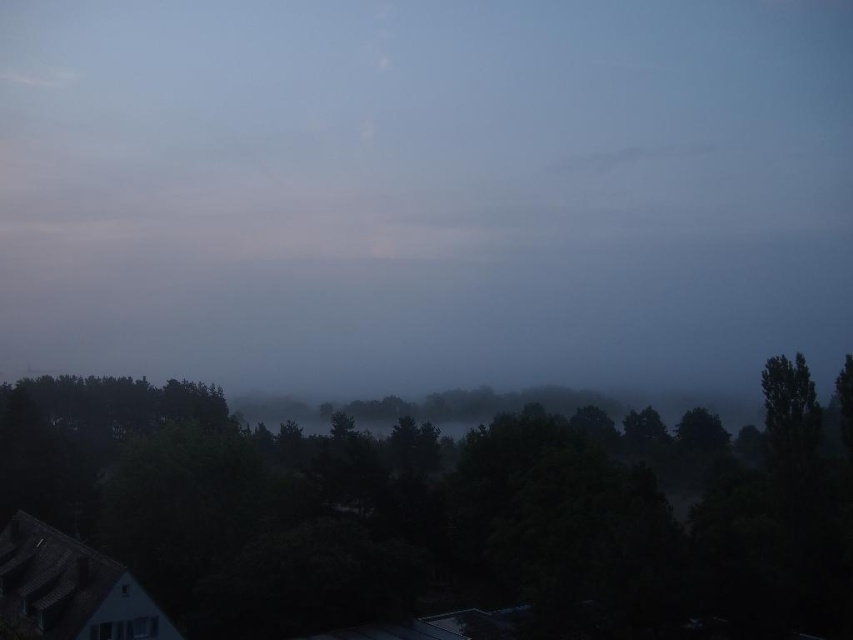
Does transparent mist at center appear on the left side of green matte tree at right?

Correct, you'll find transparent mist at center to the left of green matte tree at right.

What do you see at coordinates (425, 189) in the screenshot? This screenshot has height=640, width=853. I see `transparent mist at center` at bounding box center [425, 189].

Between point (816, 285) and point (799, 454), which one is positioned in front?

Point (799, 454)

The height and width of the screenshot is (640, 853). Identify the location of transparent mist at center. (425, 189).

Can you confirm if dark green leafy tree at center is positioned below green matte tree at right?

Correct, dark green leafy tree at center is located below green matte tree at right.

Between point (105, 499) and point (805, 374), which one is positioned in front?

Point (805, 374)

What are the coordinates of `dark green leafy tree at center` in the screenshot? It's located at (412, 518).

Does transparent mist at center come in front of dark green leafy tree at center?

No.

Who is more distant from viewer, [236,204] or [479,492]?

The point [236,204] is behind.

Which is behind, point (457, 275) or point (558, 627)?

Point (457, 275)

You are a GUI agent. You are given a task and a screenshot of the screen. Output one action in this format:
    pyautogui.click(x=<x>, y=<y>)
    Task: Click on the transparent mist at center
    
    Given the screenshot: What is the action you would take?
    pyautogui.click(x=425, y=189)